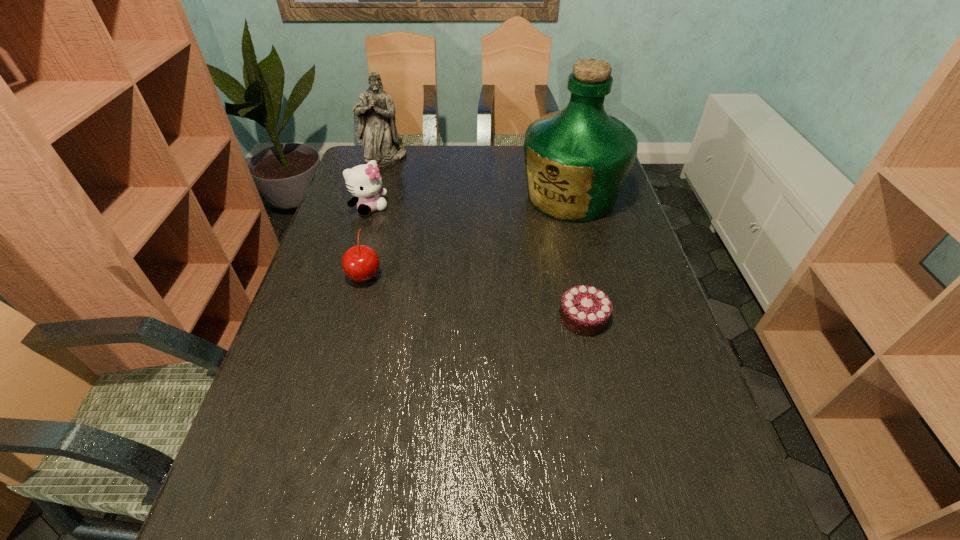
Where is `cherry`? This screenshot has height=540, width=960. cherry is located at coordinates (360, 263).

Identify the location of the fourth tallest object. The width and height of the screenshot is (960, 540). (360, 263).

Where is `the nearest object`? Image resolution: width=960 pixels, height=540 pixels. the nearest object is located at coordinates (585, 310).

Where is `chocolate cake`? This screenshot has width=960, height=540. chocolate cake is located at coordinates (585, 310).

In order to click on the second tallest object in this screenshot , I will do (376, 112).

Locate an element on the screen. The image size is (960, 540). figurine is located at coordinates (376, 112).

Where is `liquor`? liquor is located at coordinates (577, 160).

This screenshot has height=540, width=960. I want to click on the third shortest object, so click(364, 181).

At what (x,y) coordinates should I click in order to perform the action: click on free space located 0.100m on the left of the second shortest object. Please return your answer as a coordinate pair (x, y). Looking at the image, I should click on (311, 275).

Locate an element on the screen. The height and width of the screenshot is (540, 960). free region located 0.300m on the front of the chocolate cake is located at coordinates (615, 464).